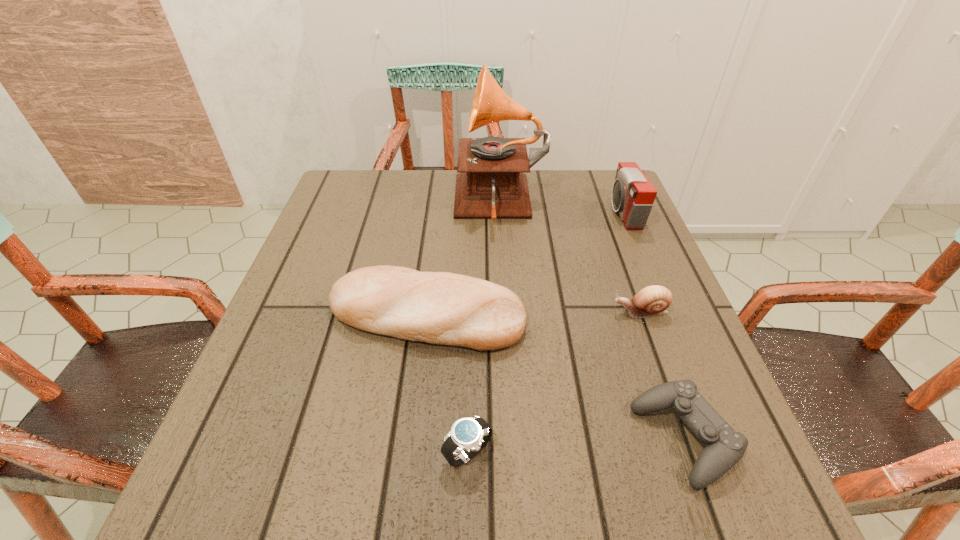
Where is `watch present at the near edge`? This screenshot has width=960, height=540. watch present at the near edge is located at coordinates (468, 436).

In order to click on control located at the near edge in this screenshot , I will do `click(724, 447)`.

This screenshot has width=960, height=540. Find the location of `object that is positioned at the left edge`. object that is positioned at the left edge is located at coordinates (445, 308).

Find the location of a particular element. The width and height of the screenshot is (960, 540). camera that is at the right edge is located at coordinates (633, 195).

Where is `escargot present at the right edge`? This screenshot has width=960, height=540. escargot present at the right edge is located at coordinates (651, 301).

This screenshot has width=960, height=540. What are the coordinates of `control at the right edge` in the screenshot? It's located at (724, 447).

Identify the location of object situated at the far right corner. This screenshot has height=540, width=960. (633, 195).

I want to click on object at the near right corner, so click(x=724, y=447).

In the image, there is a desktop. Where is `vacant area at the far edge`? vacant area at the far edge is located at coordinates (554, 195).

The image size is (960, 540). Find the location of `vacant region at the near edge of the desktop`. vacant region at the near edge of the desktop is located at coordinates (389, 486).